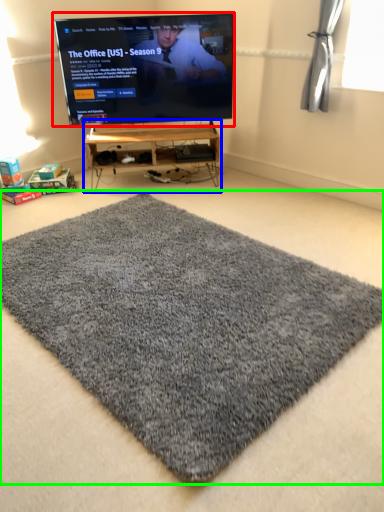
Question: Based on their relative distances, which object is nearer to television (highlighted by a red box)? Choose from furniture (highlighted by a blue box) and mat (highlighted by a green box).

Choices:
 (A) furniture
 (B) mat

Answer: (A)